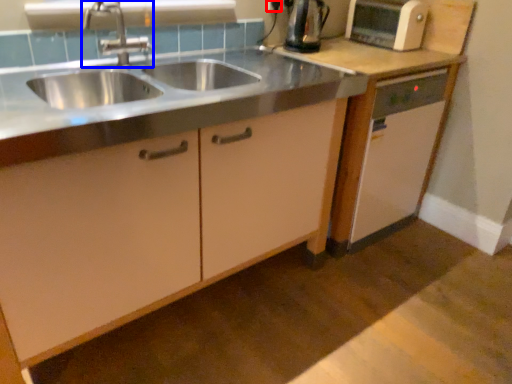
Question: Which of the following is the closest to the observer, electric outlet (highlighted by a red box) or tap (highlighted by a blue box)?

Choices:
 (A) electric outlet
 (B) tap

Answer: (B)